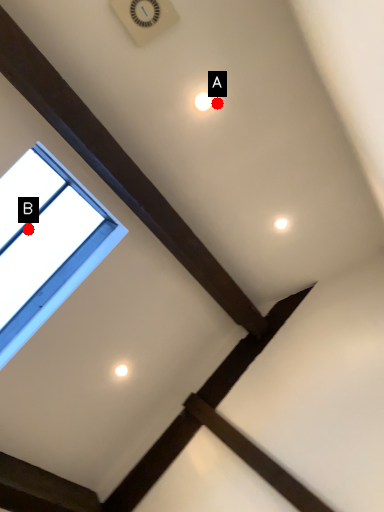
Question: Two points are circled on the image, labeled by A and B beside each circle. Among these points, which one is nearest to the camera?

Choices:
 (A) A is closer
 (B) B is closer

Answer: (A)